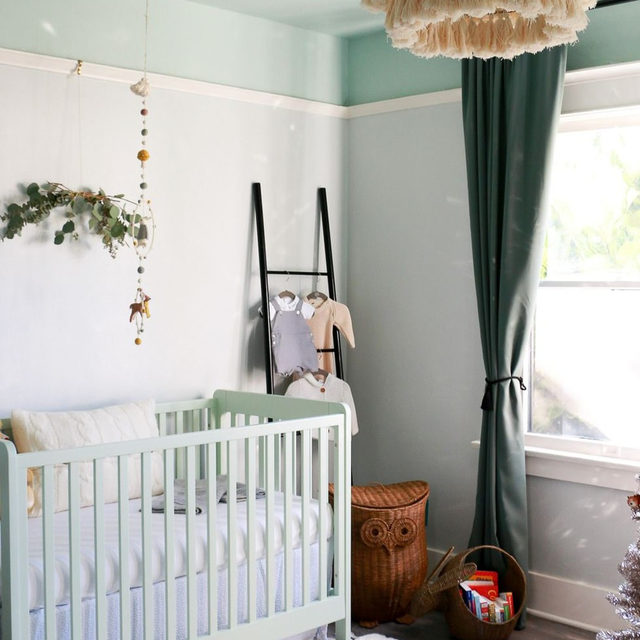
The image size is (640, 640). Identify the location of railing for crib. (182, 440), (160, 404).